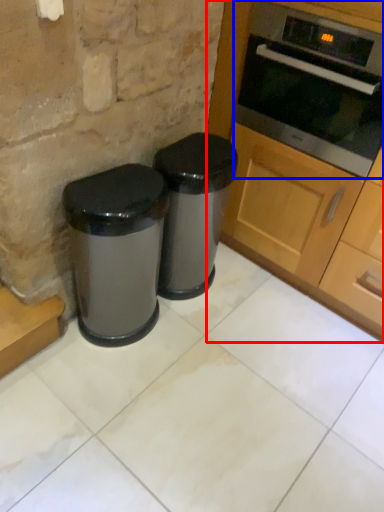
Question: Which point is closer to the camera, cabinetry (highlighted by a red box) or oven (highlighted by a blue box)?

Choices:
 (A) cabinetry
 (B) oven

Answer: (A)